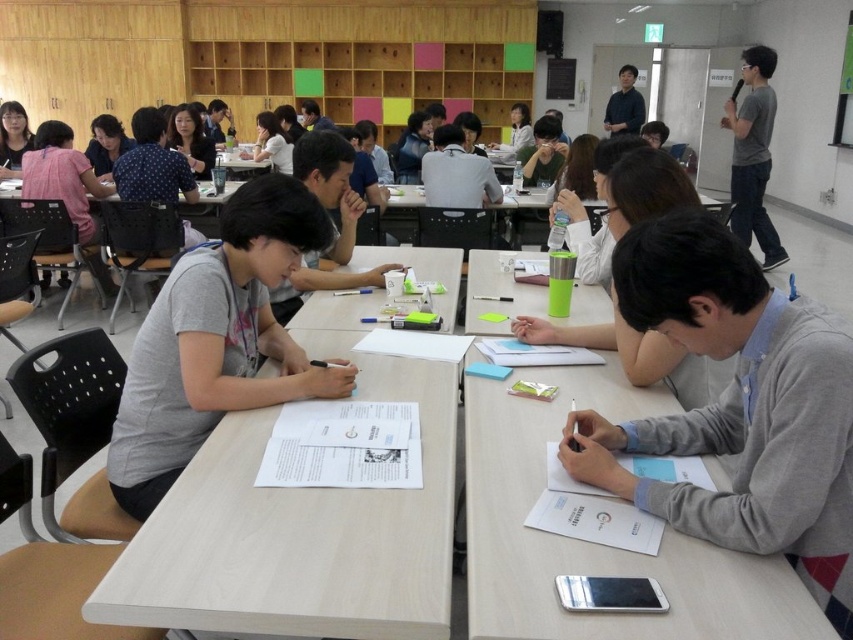
You are a student trying to place your gray cotton shirt at center on the light wood table at center. Will the shirt fit entirely on the table without hanging over the edges?

The light wood table at center is narrower than the gray cotton shirt at center, so placing the shirt on the table would cause it to hang over the edges since the table is not wide enough.

You are a student sitting at the front row of the classroom. You notice two points in the room, one at point coordinates (717,388) and another at (631,113). Which point is closer to you?

Point (717,388) is closer to the viewer than point (631,113), so the point at coordinates (717,388) is closer to you.

You are standing in the classroom and need to locate the gray cotton shirt at center. According to the coordinates provided, where exactly should you look to find it?

The gray cotton shirt at center is located at the coordinates point (218, 340).